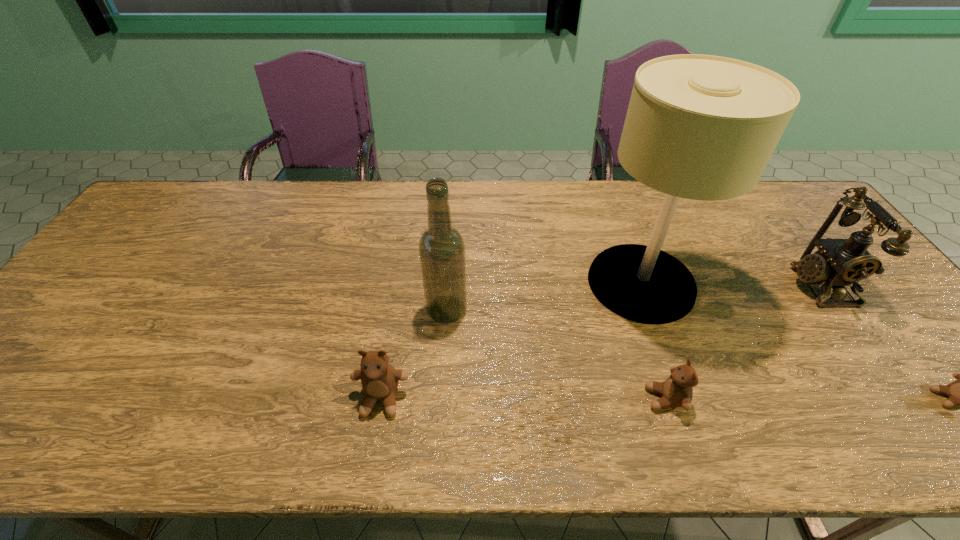
In the current image, all teddy bears are evenly spaced. To maintain this equal spacing, where should an additional teddy bear be placed on the left? Please point out a free spot. Please provide its 2D coordinates. Your answer should be formatted as a tuple, i.e. [(x, y)], where the tuple contains the x and y coordinates of a point satisfying the conditions above.

[(97, 399)]